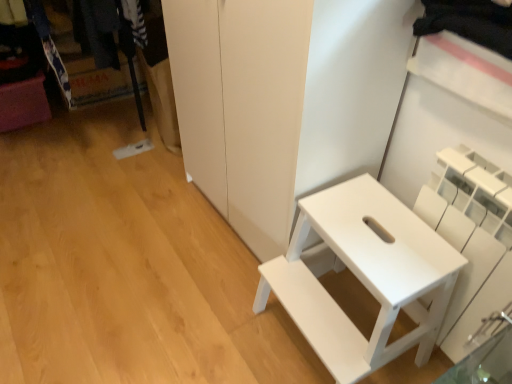
Question: Is white matte shelf at right situated inside white matte step stool at right or outside?

Choices:
 (A) inside
 (B) outside

Answer: (B)

Question: Is white matte shelf at right to the left or to the right of white matte step stool at right in the image?

Choices:
 (A) right
 (B) left

Answer: (A)

Question: From the image's perspective, is white matte shelf at right above or below white matte step stool at right?

Choices:
 (A) below
 (B) above

Answer: (B)

Question: Considering the positions of white matte step stool at right and white matte shelf at right in the image, is white matte step stool at right wider or thinner than white matte shelf at right?

Choices:
 (A) wide
 (B) thin

Answer: (A)

Question: In terms of size, does white matte step stool at right appear bigger or smaller than white matte shelf at right?

Choices:
 (A) small
 (B) big

Answer: (B)

Question: Is white matte step stool at right inside the boundaries of white matte shelf at right, or outside?

Choices:
 (A) inside
 (B) outside

Answer: (B)

Question: From the image's perspective, is white matte step stool at right above or below white matte shelf at right?

Choices:
 (A) below
 (B) above

Answer: (A)